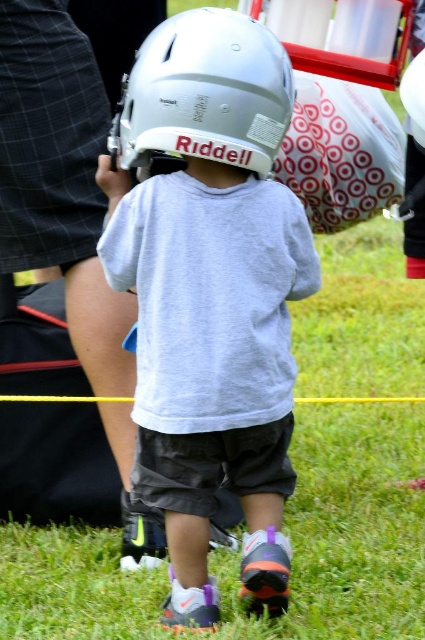
Question: Is matte gray helmet at center smaller than white matte football helmet at center?

Choices:
 (A) yes
 (B) no

Answer: (B)

Question: Which of the following is the closest to the observer?

Choices:
 (A) matte gray helmet at center
 (B) white matte football helmet at center

Answer: (B)

Question: Can you confirm if matte gray helmet at center is bigger than white matte football helmet at center?

Choices:
 (A) yes
 (B) no

Answer: (A)

Question: Which of the following is the farthest from the observer?

Choices:
 (A) matte gray helmet at center
 (B) white matte football helmet at center

Answer: (A)

Question: Does matte gray helmet at center come behind white matte football helmet at center?

Choices:
 (A) yes
 (B) no

Answer: (A)